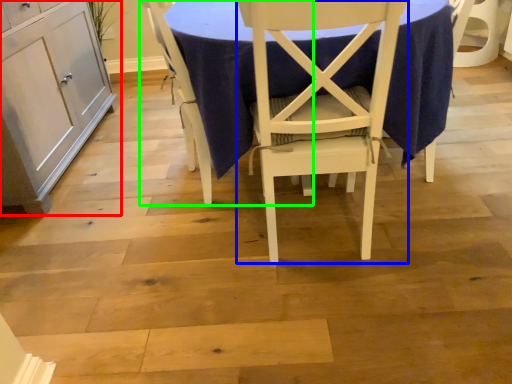
Question: Which is nearer to the cabinetry (highlighted by a red box)? chair (highlighted by a blue box) or chair (highlighted by a green box).

Choices:
 (A) chair
 (B) chair

Answer: (B)